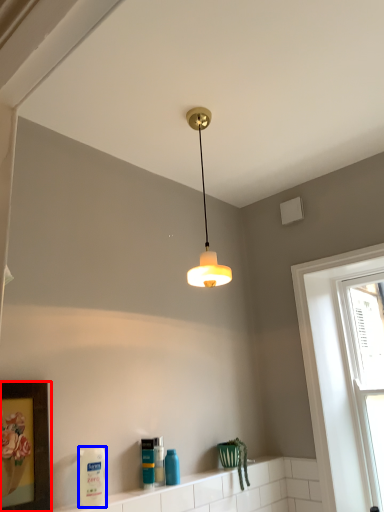
Question: Which object appears farthest to the camera in this image, picture frame (highlighted by a red box) or cleaning product (highlighted by a blue box)?

Choices:
 (A) picture frame
 (B) cleaning product

Answer: (B)